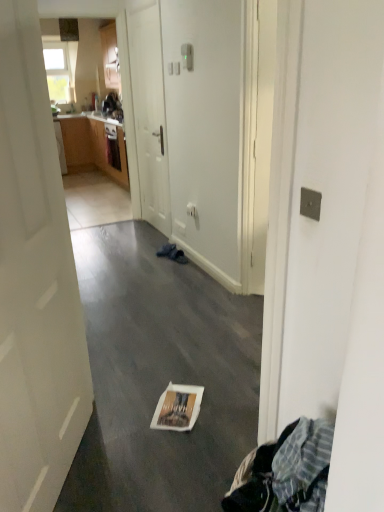
This screenshot has width=384, height=512. I want to click on free location above white glossy magazine at center (from a real-world perspective), so (x=172, y=402).